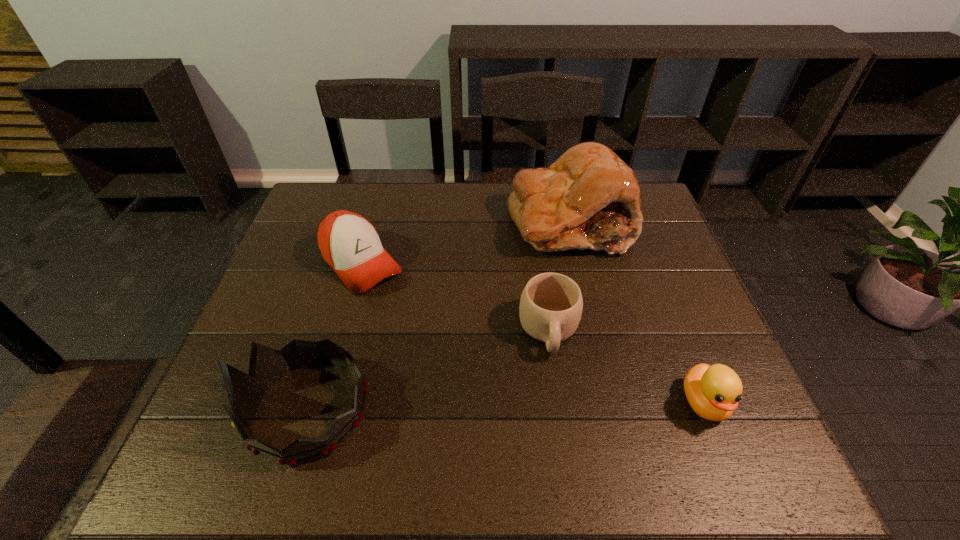
I want to click on the second tallest object, so click(267, 365).

At what (x,y) coordinates should I click in order to perform the action: click on duckling. Please return your answer as a coordinate pair (x, y). The image size is (960, 540). Looking at the image, I should click on (713, 392).

I want to click on baseball cap, so click(350, 245).

This screenshot has height=540, width=960. I want to click on the tallest object, so click(588, 198).

The image size is (960, 540). What are the coordinates of `mug` in the screenshot? It's located at (551, 304).

Find the location of a particular element. The width and height of the screenshot is (960, 540). vacant space located at the front of the tiara with jewels is located at coordinates (210, 409).

At what (x,y) coordinates should I click in order to perform the action: click on free region located 0.050m at the front of the tiara with jewels. Please return your answer as a coordinate pair (x, y). The width and height of the screenshot is (960, 540). Looking at the image, I should click on (225, 409).

Identify the location of vacant area situated on the front-facing side of the baseball cap. This screenshot has width=960, height=540. (447, 353).

The width and height of the screenshot is (960, 540). In order to click on blank space located on the front-facing side of the baseball cap in this screenshot , I will do `click(408, 313)`.

Find the location of a particular element. This screenshot has width=960, height=540. vacant space situated 0.060m on the front-facing side of the baseball cap is located at coordinates (396, 302).